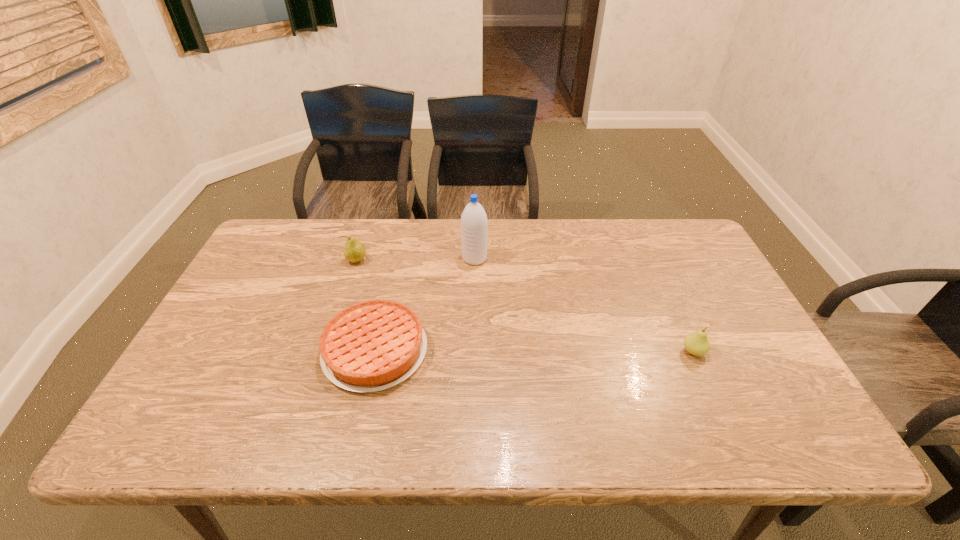
Where is `the third object from left to right`? Image resolution: width=960 pixels, height=540 pixels. the third object from left to right is located at coordinates (474, 224).

Locate an element on the screen. water bottle is located at coordinates click(474, 224).

The image size is (960, 540). What are the coordinates of `the farther pear` in the screenshot? It's located at (354, 251).

Locate an element on the screen. the nearer pear is located at coordinates (697, 343).

Locate an element on the screen. Image resolution: width=960 pixels, height=540 pixels. the rightmost object is located at coordinates (697, 343).

Find the location of `pie`. pie is located at coordinates (373, 345).

Locate an element on the screen. vacant space located 0.160m on the front of the second object from right to left is located at coordinates (474, 304).

Locate an element on the screen. The width and height of the screenshot is (960, 540). free space located 0.270m on the right of the left pear is located at coordinates (454, 260).

I want to click on free space located 0.120m on the right of the rightmost object, so pyautogui.click(x=753, y=352).

This screenshot has height=540, width=960. In order to click on vacant space located on the left of the pie in this screenshot , I will do `click(300, 350)`.